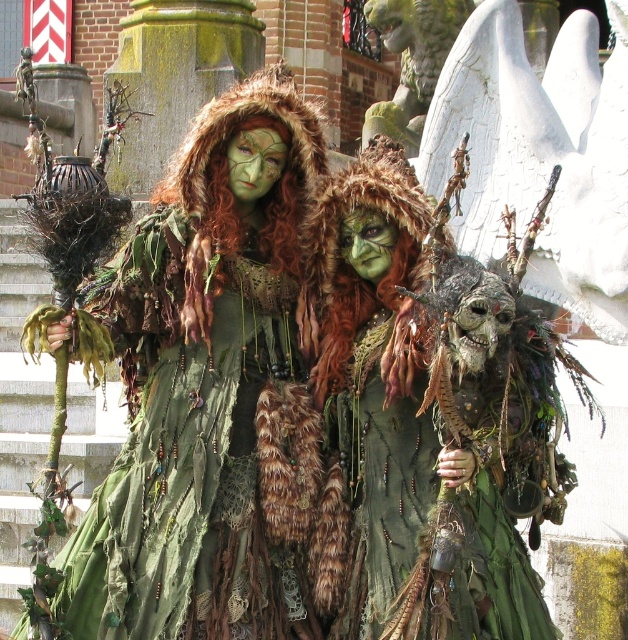
Question: Which point appears closest to the camera in this image?

Choices:
 (A) (133, 490)
 (B) (355, 289)

Answer: (A)

Question: Can you confirm if green matte fur coat at center is positioned to the right of fur-covered mask at center?

Choices:
 (A) yes
 (B) no

Answer: (B)

Question: Which point is farther to the camera?

Choices:
 (A) fur-covered mask at center
 (B) green matte fur coat at center

Answer: (B)

Question: Can you confirm if green matte fur coat at center is smaller than fur-covered mask at center?

Choices:
 (A) yes
 (B) no

Answer: (B)

Question: Is green matte fur coat at center wider than fur-covered mask at center?

Choices:
 (A) yes
 (B) no

Answer: (A)